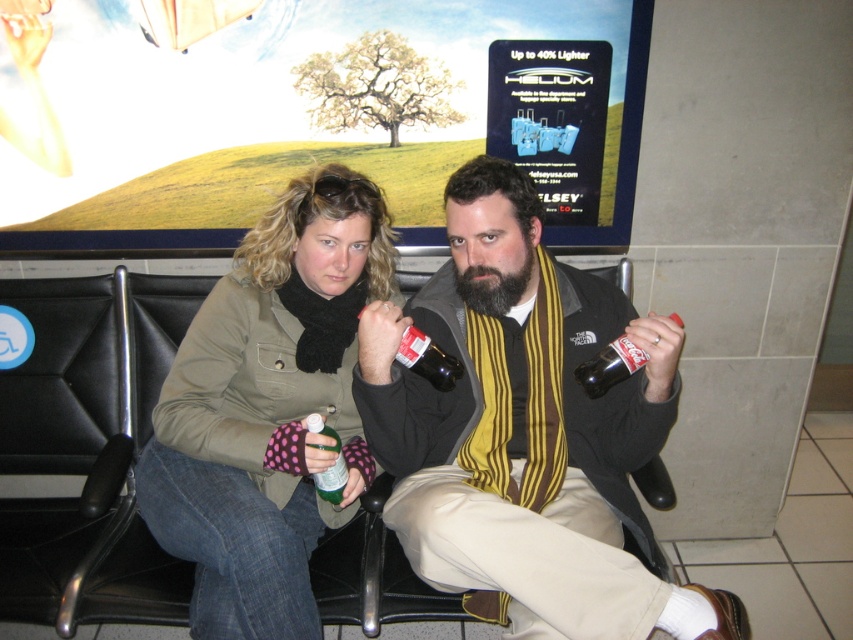
You are a security guard at the airport and need to determine if the matte black jacket at center can completely cover the green glass bottle at center without any part of the bottle visible. Based on their sizes, is this possible?

The matte black jacket at center has a larger size compared to green glass bottle at center, so yes, it can completely cover the green glass bottle at center without any part visible.

You are standing in the airport waiting area and see the matte black jacket at center and the green glass bottle at center. Which object is positioned to the right of the other?

The matte black jacket at center is to the right of the green glass bottle at center.